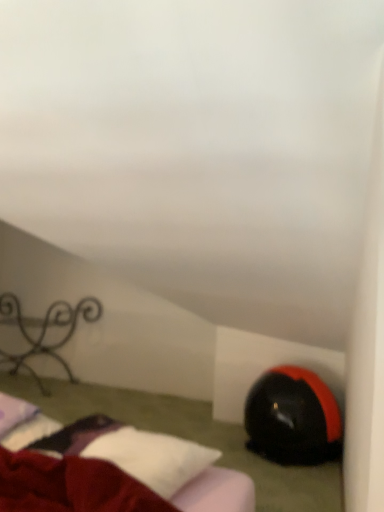
Question: Is black matte bean bag chair at lower right facing towards iron wrought iron at left?

Choices:
 (A) yes
 (B) no

Answer: (B)

Question: Is black matte bean bag chair at lower right to the left of iron wrought iron at left from the viewer's perspective?

Choices:
 (A) yes
 (B) no

Answer: (B)

Question: Could iron wrought iron at left be considered to be inside black matte bean bag chair at lower right?

Choices:
 (A) yes
 (B) no

Answer: (B)

Question: From a real-world perspective, is black matte bean bag chair at lower right under iron wrought iron at left?

Choices:
 (A) no
 (B) yes

Answer: (B)

Question: Is black matte bean bag chair at lower right beside iron wrought iron at left?

Choices:
 (A) yes
 (B) no

Answer: (B)

Question: Considering the relative positions of velvet red bed at lower left and black matte bean bag chair at lower right in the image provided, is velvet red bed at lower left to the left or to the right of black matte bean bag chair at lower right?

Choices:
 (A) right
 (B) left

Answer: (B)

Question: Is point (127, 474) positioned closer to the camera than point (329, 433)?

Choices:
 (A) farther
 (B) closer

Answer: (B)

Question: Do you think velvet red bed at lower left is within black matte bean bag chair at lower right, or outside of it?

Choices:
 (A) outside
 (B) inside

Answer: (A)

Question: Relative to black matte bean bag chair at lower right, is velvet red bed at lower left in front or behind?

Choices:
 (A) front
 (B) behind

Answer: (A)

Question: Which is correct: iron wrought iron at left is inside black matte bean bag chair at lower right, or outside of it?

Choices:
 (A) outside
 (B) inside

Answer: (A)

Question: Does point pyautogui.click(x=56, y=357) appear closer or farther from the camera than point pyautogui.click(x=246, y=404)?

Choices:
 (A) farther
 (B) closer

Answer: (A)

Question: Considering the positions of iron wrought iron at left and black matte bean bag chair at lower right in the image, is iron wrought iron at left wider or thinner than black matte bean bag chair at lower right?

Choices:
 (A) thin
 (B) wide

Answer: (A)

Question: Considering the positions of iron wrought iron at left and black matte bean bag chair at lower right in the image, is iron wrought iron at left taller or shorter than black matte bean bag chair at lower right?

Choices:
 (A) tall
 (B) short

Answer: (A)

Question: Considering the positions of black matte bean bag chair at lower right and iron wrought iron at left in the image, is black matte bean bag chair at lower right taller or shorter than iron wrought iron at left?

Choices:
 (A) tall
 (B) short

Answer: (B)

Question: Relative to iron wrought iron at left, is black matte bean bag chair at lower right in front or behind?

Choices:
 (A) behind
 (B) front

Answer: (B)